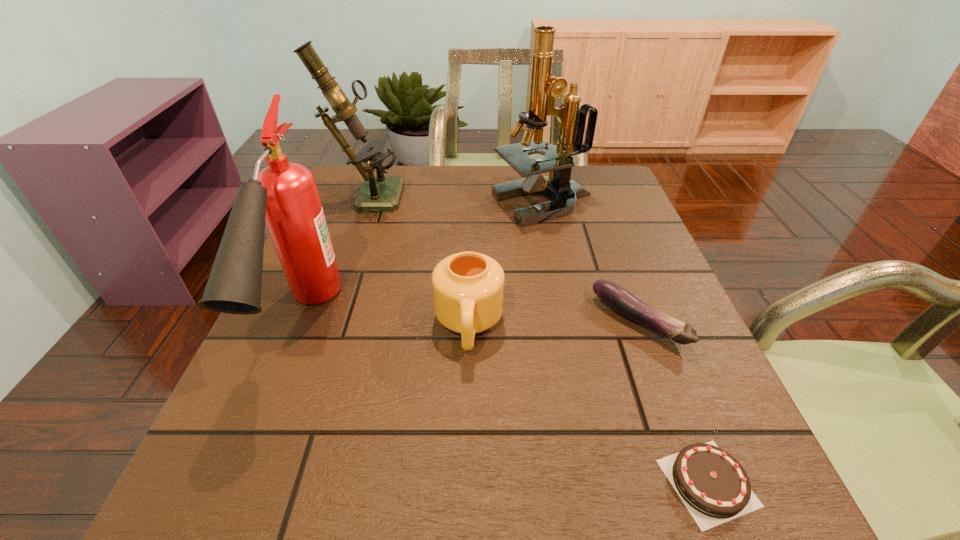
I want to click on chocolate cake present at the right edge, so click(x=715, y=488).

This screenshot has width=960, height=540. Identify the location of object present at the far left corner. (382, 193).

Find the location of a particular element. The width and height of the screenshot is (960, 540). object present at the far right corner is located at coordinates (544, 87).

I want to click on object at the near right corner, so click(x=715, y=488).

I want to click on vacant space at the far edge of the desktop, so click(x=454, y=190).

I want to click on vacant space at the left edge of the desktop, so click(283, 353).

The height and width of the screenshot is (540, 960). Find the location of `vacant area at the right edge of the desktop`. vacant area at the right edge of the desktop is located at coordinates (677, 356).

Where is `vacant space at the near left corner`? This screenshot has height=540, width=960. vacant space at the near left corner is located at coordinates (232, 532).

Where is `vacant point located between the left microscope and the right microscope`? The height and width of the screenshot is (540, 960). vacant point located between the left microscope and the right microscope is located at coordinates [x=455, y=199].

Find the location of a particular element. The width and height of the screenshot is (960, 540). free spot between the mug and the fifth tallest object is located at coordinates (553, 323).